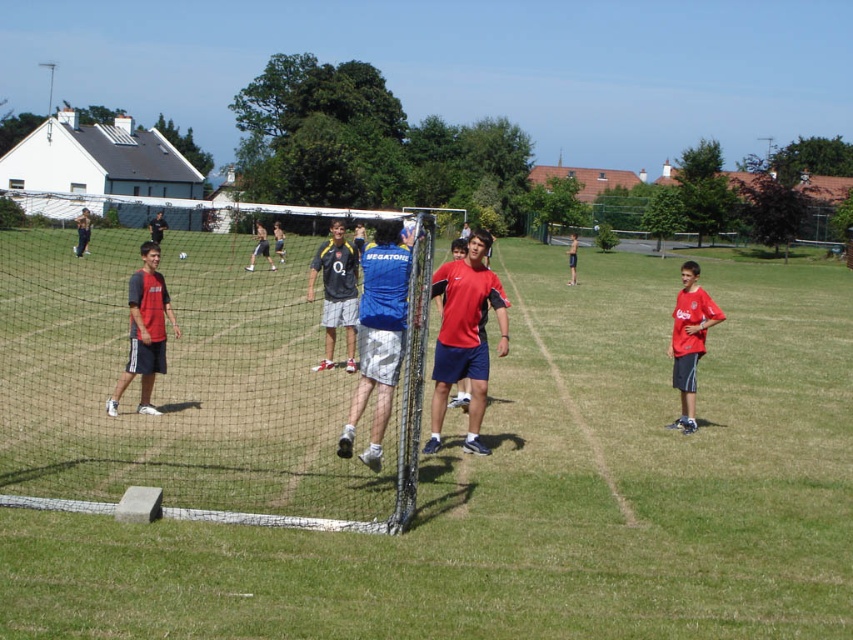
You are a photographer trying to capture a clear shot of the red fabric shirt at center and the matte gray shorts at center. Based on their sizes, which one would appear smaller in the photo?

The red fabric shirt at center appears smaller in the photo because it is not as tall as the matte gray shorts at center.

You are a photographer trying to capture a photo of the dark gray fabric shorts at left without including the green grass field at center in the background. Is this possible given their positions?

The green grass field at center is in front of the dark gray fabric shorts at left, so the dark gray fabric shorts at left would be behind the grass field in the photo. Therefore, it is not possible to capture the dark gray fabric shorts at left without the green grass field at center appearing in front of them in the background.

You are standing at the goalpost and want to kick a ball to a friend. The ball is at point (450, 289) and your friend is at point (325, 337). Which point is closer to you?

Point (450, 289) is in front of point (325, 337), so the ball at point (450, 289) is closer to you.